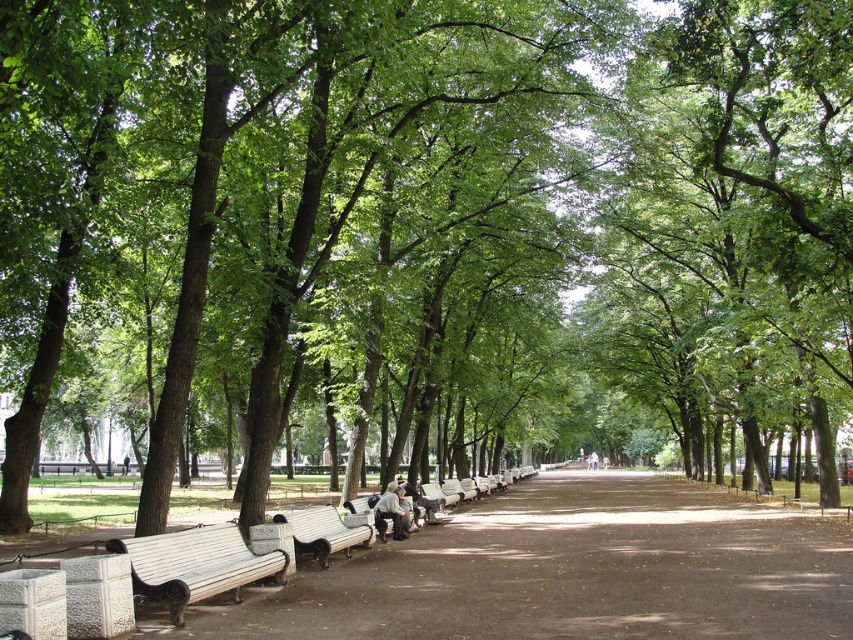
Does wooden bench at lower left have a greater width compared to wooden bench at center?

In fact, wooden bench at lower left might be narrower than wooden bench at center.

Does wooden bench at lower left appear on the right side of wooden bench at center?

Incorrect, wooden bench at lower left is not on the right side of wooden bench at center.

The width and height of the screenshot is (853, 640). What do you see at coordinates (195, 564) in the screenshot?
I see `wooden bench at lower left` at bounding box center [195, 564].

Where is `wooden bench at lower left`? Image resolution: width=853 pixels, height=640 pixels. wooden bench at lower left is located at coordinates (195, 564).